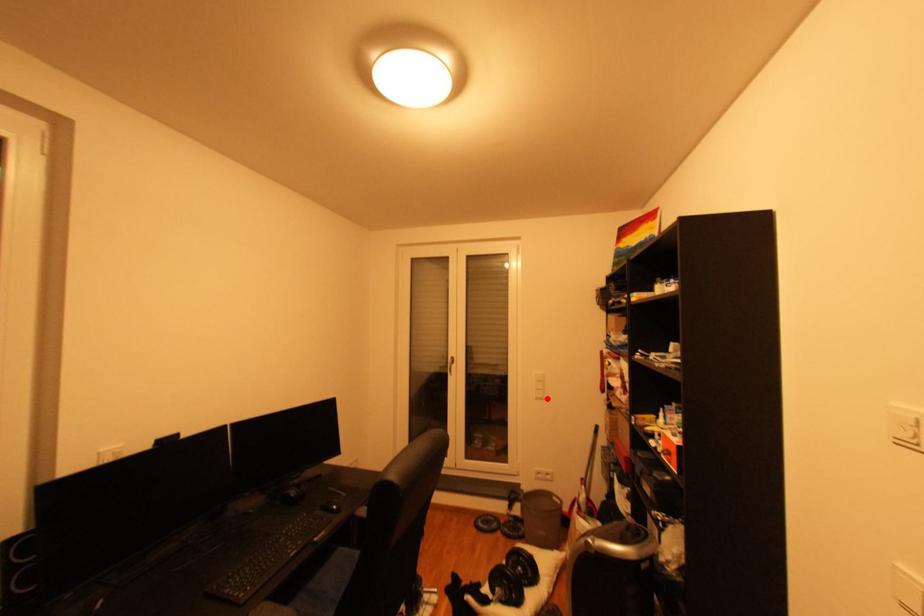
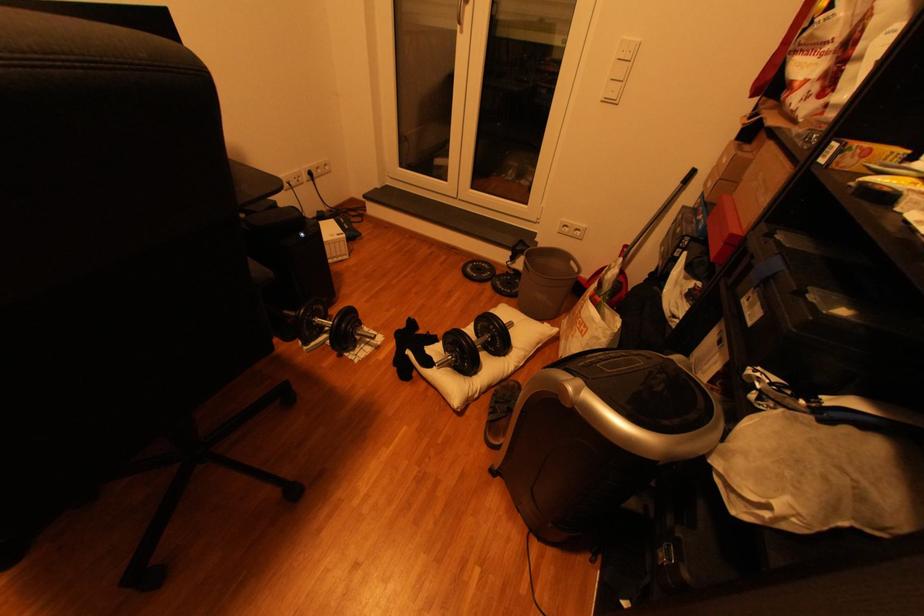
Locate, in the second image, the point that corresponds to the highlighted location in the first image.

(614, 100)